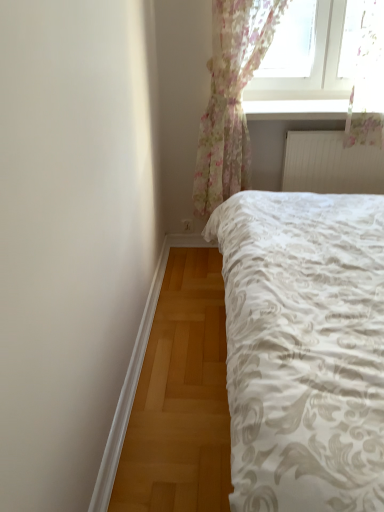
What do you see at coordinates (330, 164) in the screenshot? I see `white textured radiator at upper right` at bounding box center [330, 164].

In order to face white textured bed at center, should I rotate leftwards or rightwards?

To align with it, rotate right about 20.804°.

Locate an element on the screen. white textured radiator at upper right is located at coordinates (330, 164).

From a real-world perspective, which object stands above the other?

In real-world perspective, white textured radiator at upper right is above.

Is white textured radiator at upper right smaller than white textured bed at center?

Correct, white textured radiator at upper right occupies less space than white textured bed at center.

Find the location of a particular element. The height and width of the screenshot is (512, 384). bed below the white textured radiator at upper right (from the image's perspective) is located at coordinates (304, 349).

Considering the sizes of objects white textured radiator at upper right and white textured bed at center in the image provided, who is taller, white textured radiator at upper right or white textured bed at center?

Standing taller between the two is white textured bed at center.

Does white textured bed at center appear on the left side of floral sheer curtain at upper right?

In fact, white textured bed at center is to the right of floral sheer curtain at upper right.

Which of these two, white textured bed at center or floral sheer curtain at upper right, stands shorter?

white textured bed at center is shorter.

Is white textured bed at center not near floral sheer curtain at upper right?

They are positioned close to each other.

Considering the sizes of objects white textured bed at center and floral sheer curtain at upper right in the image provided, who is wider, white textured bed at center or floral sheer curtain at upper right?

Wider between the two is white textured bed at center.

Is white textured bed at center to the left or to the right of white textured radiator at upper right in the image?

white textured bed at center is to the left of white textured radiator at upper right.

Is white textured bed at center oriented towards white textured radiator at upper right?

No.

Can you tell me how much white textured bed at center and white textured radiator at upper right differ in facing direction?

white textured bed at center and white textured radiator at upper right are facing 91.1 degrees away from each other.

Which is correct: white textured bed at center is inside white textured radiator at upper right, or outside of it?

The correct answer is: outside.

Is floral sheer curtain at upper right far from white textured radiator at upper right?

That's not correct — floral sheer curtain at upper right is a little close to white textured radiator at upper right.

Is point (247, 169) positioned behind point (335, 156)?

Yes.

From a real-world perspective, which object rests below the other?

white textured radiator at upper right is physically lower.

Considering the relative positions of floral sheer curtain at upper right and white textured radiator at upper right in the image provided, is floral sheer curtain at upper right behind white textured radiator at upper right?

No, the depth of floral sheer curtain at upper right is less than that of white textured radiator at upper right.

In the scene shown: Which object is closer to the camera taking this photo, floral sheer curtain at upper right or white textured bed at center?

white textured bed at center is in front.

Is floral sheer curtain at upper right inside or outside of white textured bed at center?

floral sheer curtain at upper right is not enclosed by white textured bed at center.

Where is `bed below the floral sheer curtain at upper right (from the image's perspective)`? The width and height of the screenshot is (384, 512). bed below the floral sheer curtain at upper right (from the image's perspective) is located at coordinates (304, 349).

From a real-world perspective, who is located lower, floral sheer curtain at upper right or white textured bed at center?

From a 3D spatial view, white textured bed at center is below.

In the scene shown: Is white textured radiator at upper right placed right next to floral sheer curtain at upper right?

white textured radiator at upper right and floral sheer curtain at upper right are not in contact.

How distant is white textured radiator at upper right from floral sheer curtain at upper right?

white textured radiator at upper right is 44.45 centimeters away from floral sheer curtain at upper right.

What's the angular difference between white textured radiator at upper right and floral sheer curtain at upper right's facing directions?

0.0622 degrees.

Is white textured radiator at upper right positioned beyond the bounds of floral sheer curtain at upper right?

No, white textured radiator at upper right is inside floral sheer curtain at upper right's boundary.

Find the location of a particular element. This screenshot has width=384, height=512. radiator behind the white textured bed at center is located at coordinates (330, 164).

Find the location of a particular element. The height and width of the screenshot is (512, 384). bed lying in front of the floral sheer curtain at upper right is located at coordinates (304, 349).

Based on their spatial positions, is white textured bed at center or white textured radiator at upper right further from floral sheer curtain at upper right?

white textured bed at center lies further to floral sheer curtain at upper right than the other object.

From the image, which object appears to be nearer to floral sheer curtain at upper right, white textured radiator at upper right or white textured bed at center?

Among the two, white textured radiator at upper right is located nearer to floral sheer curtain at upper right.

Estimate the real-world distances between objects in this image. Which object is closer to white textured bed at center, floral sheer curtain at upper right or white textured radiator at upper right?

floral sheer curtain at upper right is closer to white textured bed at center.

When comparing their distances from white textured bed at center, does white textured radiator at upper right or floral sheer curtain at upper right seem further?

white textured radiator at upper right is positioned further to the anchor white textured bed at center.

Looking at the image, which one is located closer to white textured radiator at upper right, floral sheer curtain at upper right or white textured bed at center?

floral sheer curtain at upper right.

From the image, which object appears to be farther from white textured radiator at upper right, white textured bed at center or floral sheer curtain at upper right?

white textured bed at center is positioned further to the anchor white textured radiator at upper right.

The width and height of the screenshot is (384, 512). Find the location of `curtain between white textured bed at center and white textured radiator at upper right along the z-axis`. curtain between white textured bed at center and white textured radiator at upper right along the z-axis is located at coordinates (231, 98).